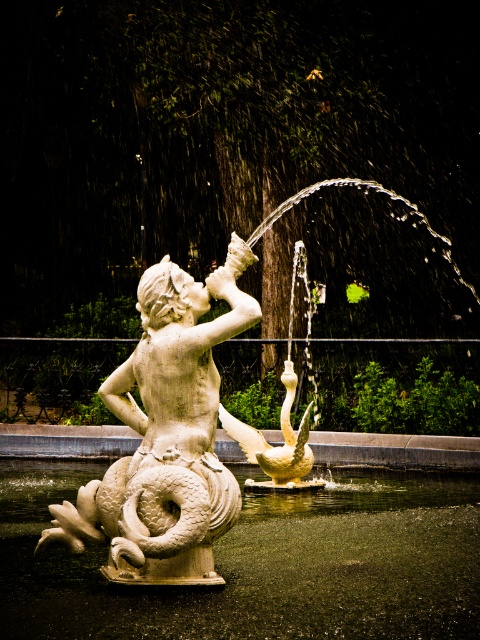
Question: Which point is farther to the camera?

Choices:
 (A) white stone mermaid at center
 (B) white stone fountain at center

Answer: (B)

Question: Can you confirm if white stone fountain at center is positioned below white stone mermaid at center?

Choices:
 (A) no
 (B) yes

Answer: (A)

Question: Observing the image, what is the correct spatial positioning of white stone water at lower center in reference to white stone fountain at center?

Choices:
 (A) right
 (B) left

Answer: (B)

Question: Which is nearer to the white stone water at lower center?

Choices:
 (A) white stone mermaid at center
 (B) white stone fountain at center

Answer: (A)

Question: Which of the following is the farthest from the observer?

Choices:
 (A) white stone mermaid at center
 (B) white stone fountain at center
 (C) white stone water at lower center

Answer: (B)

Question: Is the position of white stone fountain at center more distant than that of white stone mermaid at center?

Choices:
 (A) no
 (B) yes

Answer: (B)